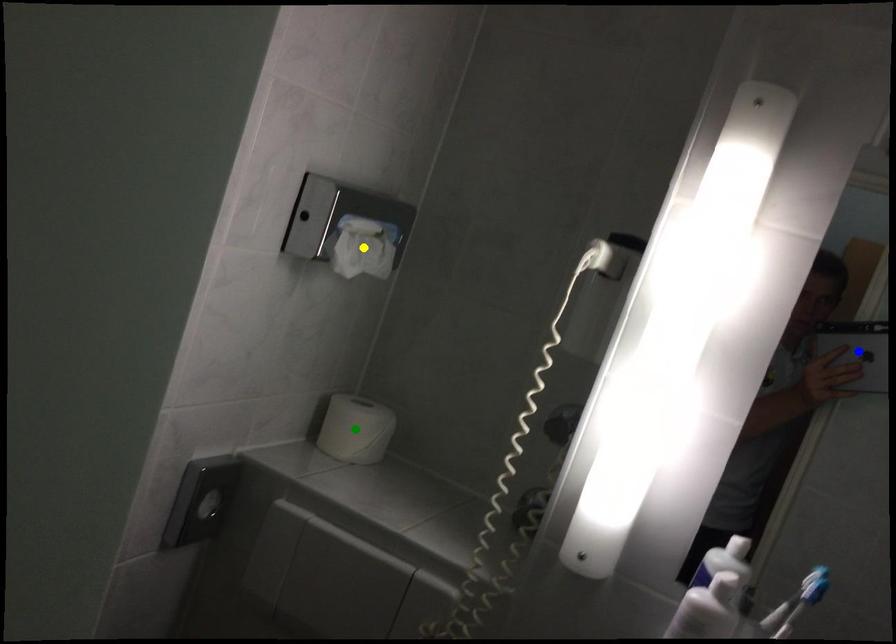
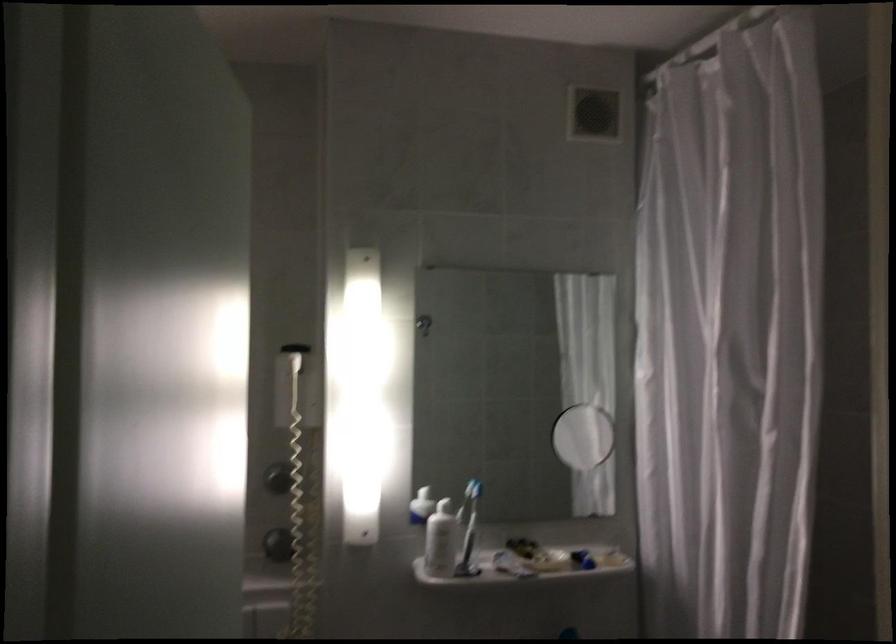
I am providing you with two images of the same scene from different viewpoints. Three points are marked in image1. Which point corresponds to a part or object that is occluded in image2?In image1, three points are marked. Which of them correspond to a part or object that is occluded in image2?Among the three points shown in image1, which one corresponds to a part or object that is no longer visible due to occlusion in image2?

green point, blue point, yellow point cannot be seen in image2.